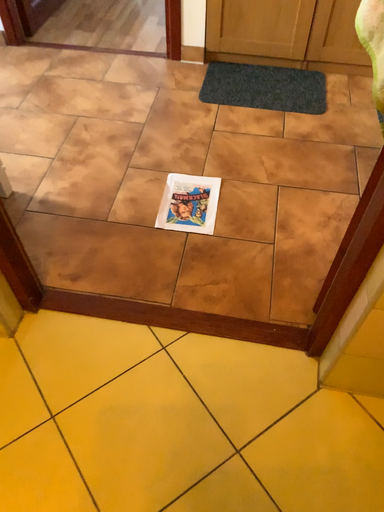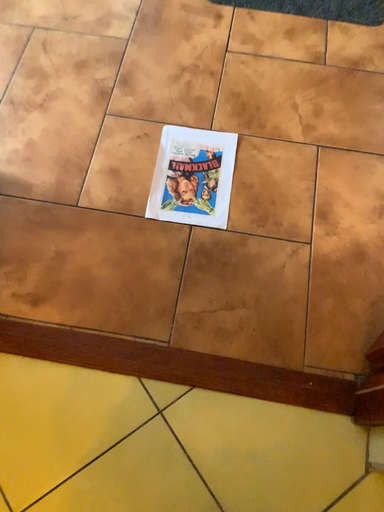
Question: Which way did the camera rotate in the video?

Choices:
 (A) rotated downward
 (B) rotated upward

Answer: (A)